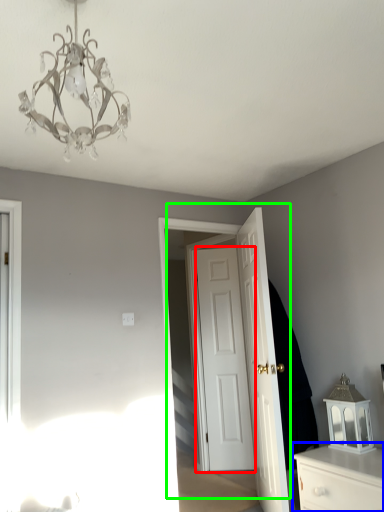
Question: Considering the real-world distances, which object is farthest from door (highlighted by a red box)? chest of drawers (highlighted by a blue box) or door (highlighted by a green box)?

Choices:
 (A) chest of drawers
 (B) door

Answer: (A)